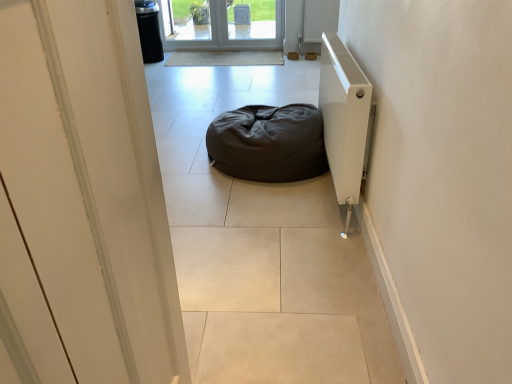
Question: Considering the relative positions of white glossy door at upper center and dark fabric bean bag at center in the image provided, is white glossy door at upper center to the left or to the right of dark fabric bean bag at center?

Choices:
 (A) left
 (B) right

Answer: (A)

Question: In the image, is white glossy door at upper center positioned in front of or behind dark fabric bean bag at center?

Choices:
 (A) front
 (B) behind

Answer: (A)

Question: Which object is the closest to the dark fabric bean bag at center?

Choices:
 (A) white textured radiator at right
 (B) white glossy door at upper center

Answer: (A)

Question: Estimate the real-world distances between objects in this image. Which object is farther from the white textured radiator at right?

Choices:
 (A) white glossy door at upper center
 (B) dark fabric bean bag at center

Answer: (A)